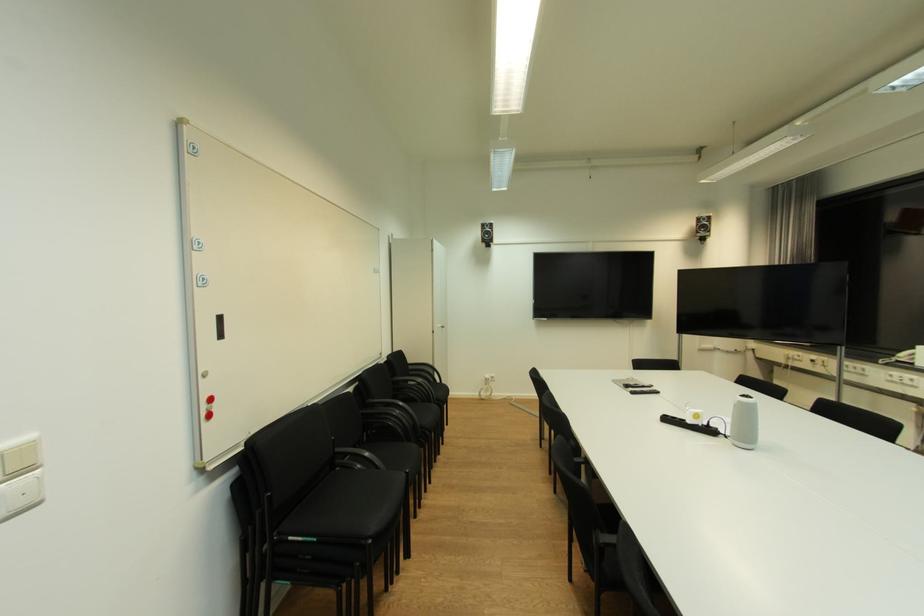
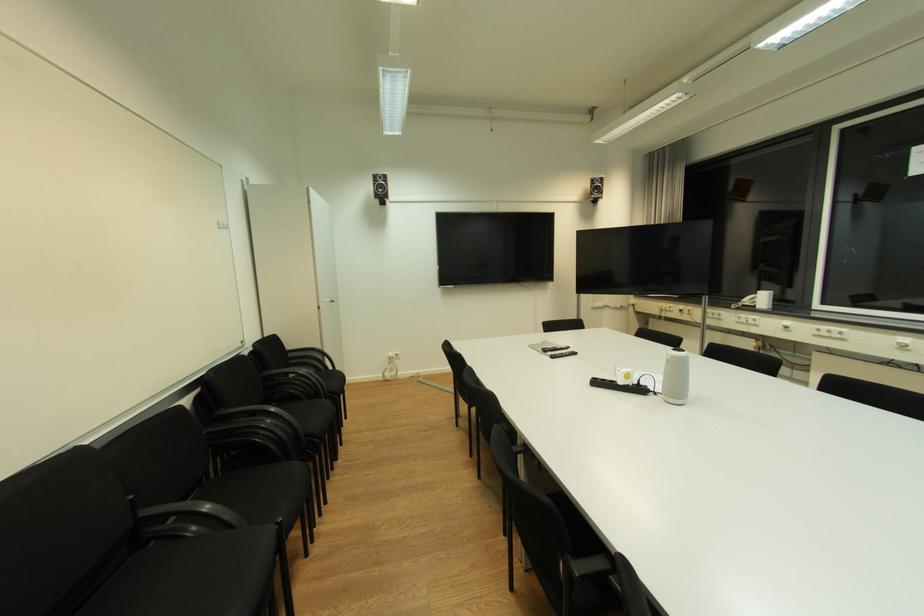
Where in the second image is the point corresponding to point 746,403 from the first image?

(678, 358)